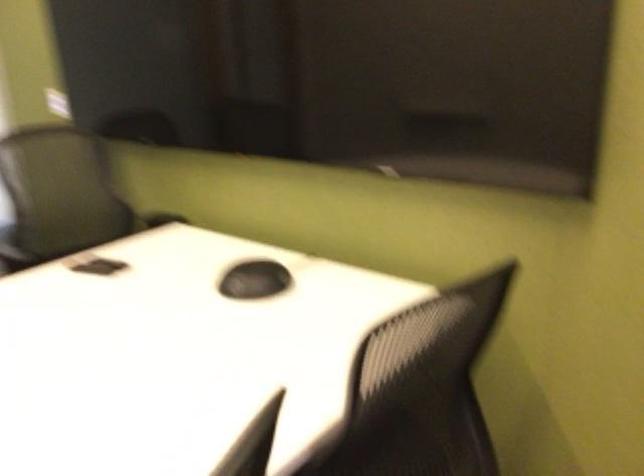
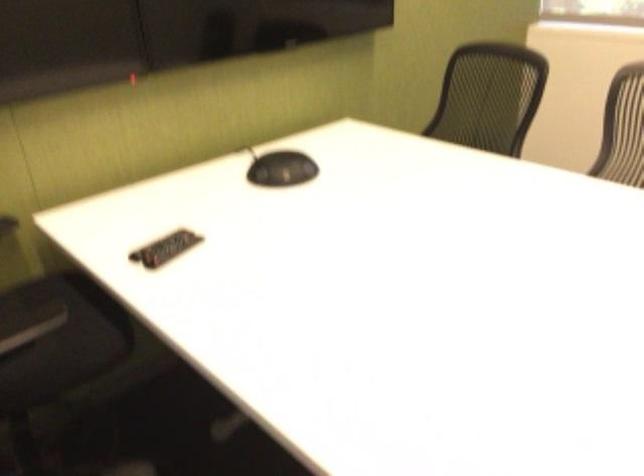
Locate, in the second image, the point that corresponds to (x=243, y=278) in the first image.

(281, 169)